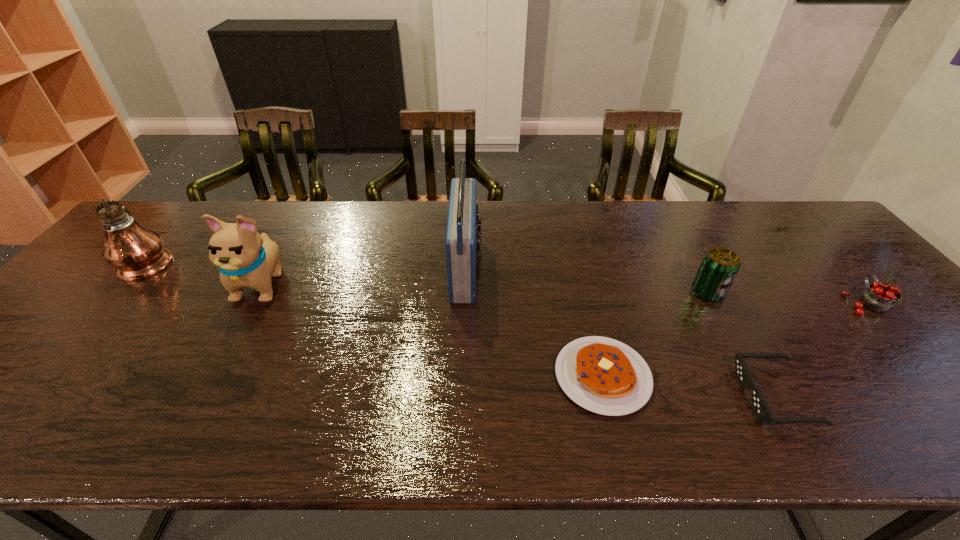
Where is `free space that is in between the fourth shortest object and the oil lamp`? This screenshot has width=960, height=540. free space that is in between the fourth shortest object and the oil lamp is located at coordinates (428, 278).

Identify the location of object that ranks as the fifth closest to the leftmost object. (759, 404).

This screenshot has width=960, height=540. What are the coordinates of `object that stands as the closest to the second object from left to right` in the screenshot? It's located at (137, 253).

Identify the location of vacant space that satisfies the following two spatial constraints: 1. on the handle side of the fifth tallest object; 2. on the front panel of the fifth object from right to left. (832, 268).

Identify the location of free space in the image that satisfies the following two spatial constraints: 1. on the front panel of the third object from left to right; 2. on the left side of the beer can. (466, 294).

Find the location of a particular element. Image resolution: width=960 pixels, height=540 pixels. free spot that satisfies the following two spatial constraints: 1. on the front panel of the pancake; 2. on the left side of the third object from left to right is located at coordinates (463, 376).

What are the coordinates of `free region that satisfies the following two spatial constraints: 1. on the front side of the beer can; 2. on the left side of the tallest object` in the screenshot? It's located at (120, 294).